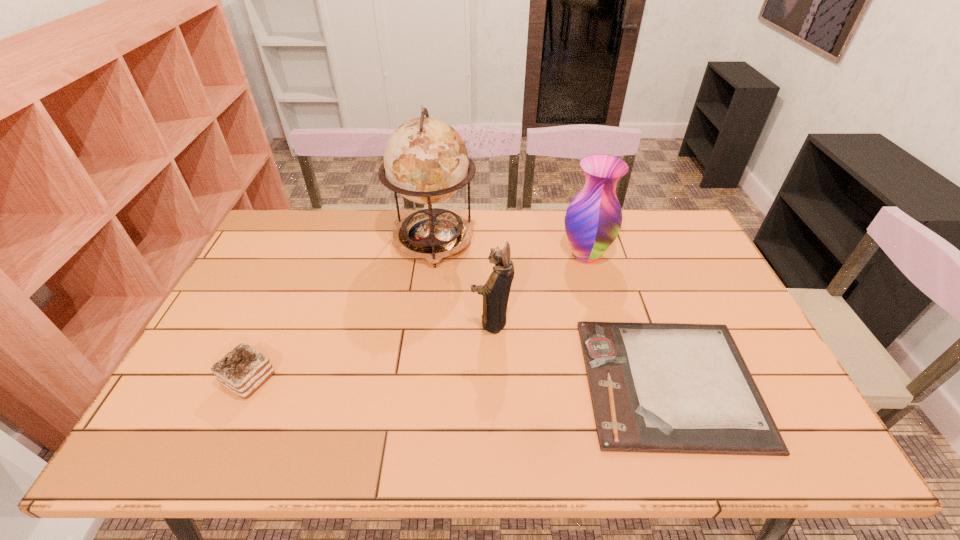
The width and height of the screenshot is (960, 540). I want to click on blank space located 0.310m on the front-facing side of the figurine, so click(362, 322).

Identify the location of vacant space located on the back of the fourth tallest object. point(274,324).

Identify the location of free space located on the left of the shortest object. This screenshot has height=540, width=960. (454, 382).

Find the location of a particular element. This screenshot has height=540, width=960. globe that is positioned at the far edge is located at coordinates (426, 161).

Identify the location of vase that is at the far edge. [593, 219].

I want to click on object at the near edge, so click(655, 387).

Where is `object present at the left edge`? The height and width of the screenshot is (540, 960). object present at the left edge is located at coordinates (243, 370).

Find the location of a particular element. object that is at the right edge is located at coordinates (655, 387).

Identify the location of object at the near right corner. (655, 387).

In the image, there is a desktop. In order to click on blank space at the far edge in this screenshot , I will do `click(625, 221)`.